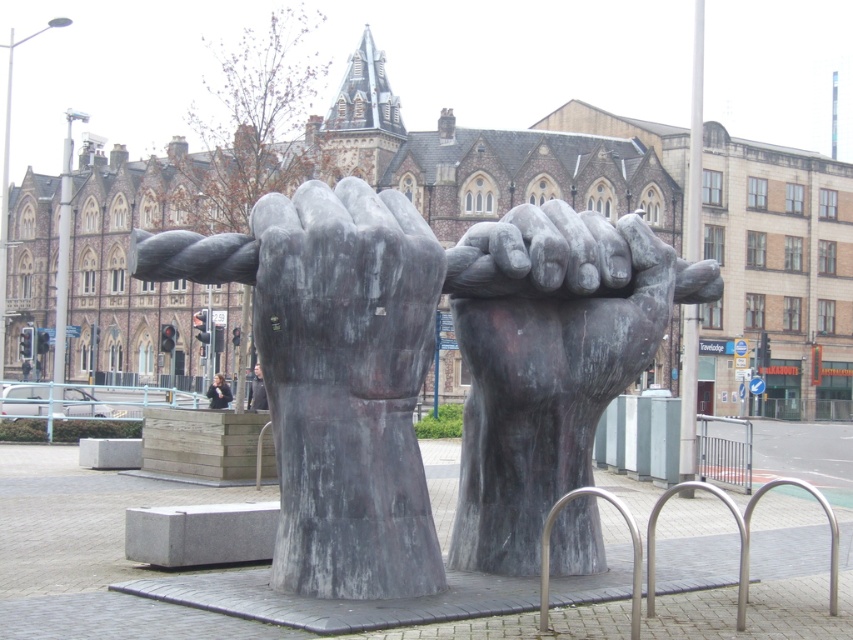
You are a delivery robot with a box that is 32 inches long. You need to navigate through the space between the matte gray stone fists at center and the rustic stone fist at center. Can your box fit through the gap between them without bending or breaking?

The distance between the matte gray stone fists at center and the rustic stone fist at center is 33.01 inches. Since your box is 32 inches long, it can fit through the gap without bending or breaking.

You are a delivery person needing to place a light brown leather jacket at center on a shelf that can only hold items within 30 meters of it. The shelf is located near the rustic stone fist at center. Can you place the jacket on the shelf?

The light brown leather jacket at center and rustic stone fist at center are 32.63 meters apart from each other. Since the shelf can only hold items within 30 meters, the jacket is too far to be placed on the shelf.

What are the coordinates of the rustic stone fist at center?

The rustic stone fist at center is located at coordinates point (548, 358).